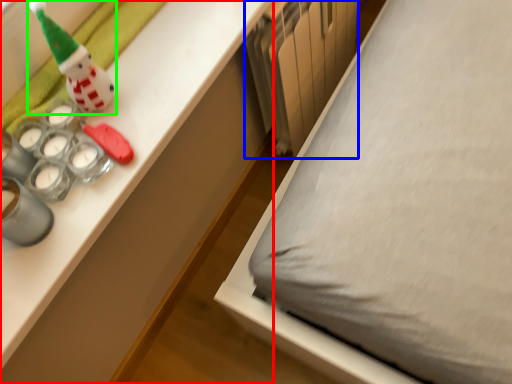
Question: Based on their relative distances, which object is nearer to desk (highlighted by a red box)? Choose from radiator (highlighted by a blue box) and toy (highlighted by a green box).

Choices:
 (A) radiator
 (B) toy

Answer: (A)